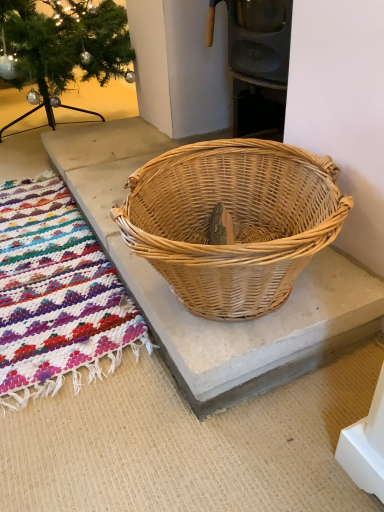
Question: Is point (160, 188) closer or farther from the camera than point (23, 193)?

Choices:
 (A) closer
 (B) farther

Answer: (A)

Question: In terms of size, does natural wicker basket at center appear bigger or smaller than multicolored woven mat at lower left?

Choices:
 (A) small
 (B) big

Answer: (B)

Question: Considering the positions of natural wicker basket at center and multicolored woven mat at lower left in the image, is natural wicker basket at center taller or shorter than multicolored woven mat at lower left?

Choices:
 (A) tall
 (B) short

Answer: (A)

Question: From a real-world perspective, is multicolored woven mat at lower left positioned above or below natural wicker basket at center?

Choices:
 (A) below
 (B) above

Answer: (A)

Question: Which is correct: multicolored woven mat at lower left is inside natural wicker basket at center, or outside of it?

Choices:
 (A) inside
 (B) outside

Answer: (B)

Question: Is multicolored woven mat at lower left wider or thinner than natural wicker basket at center?

Choices:
 (A) wide
 (B) thin

Answer: (B)

Question: Is point (8, 225) closer or farther from the camera than point (213, 278)?

Choices:
 (A) farther
 (B) closer

Answer: (A)